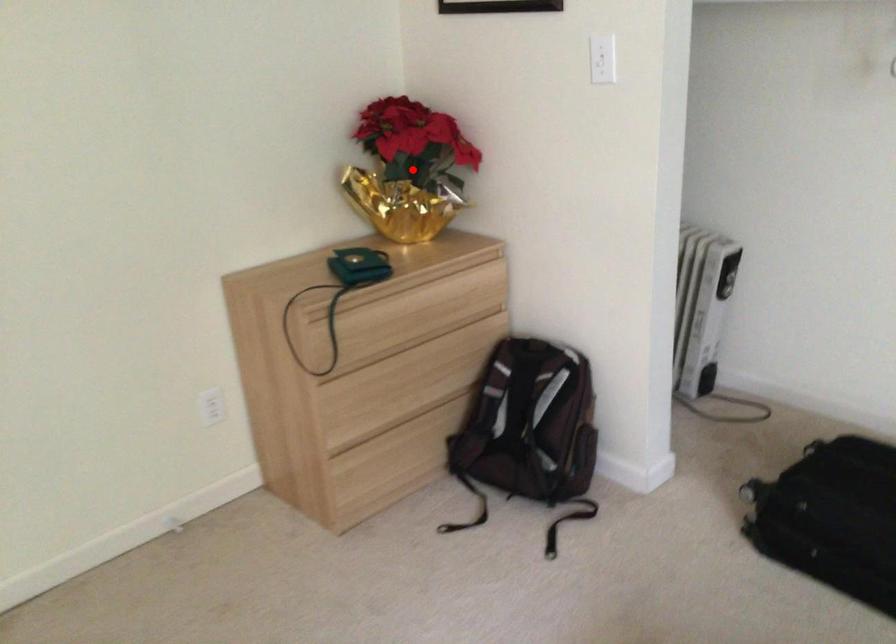
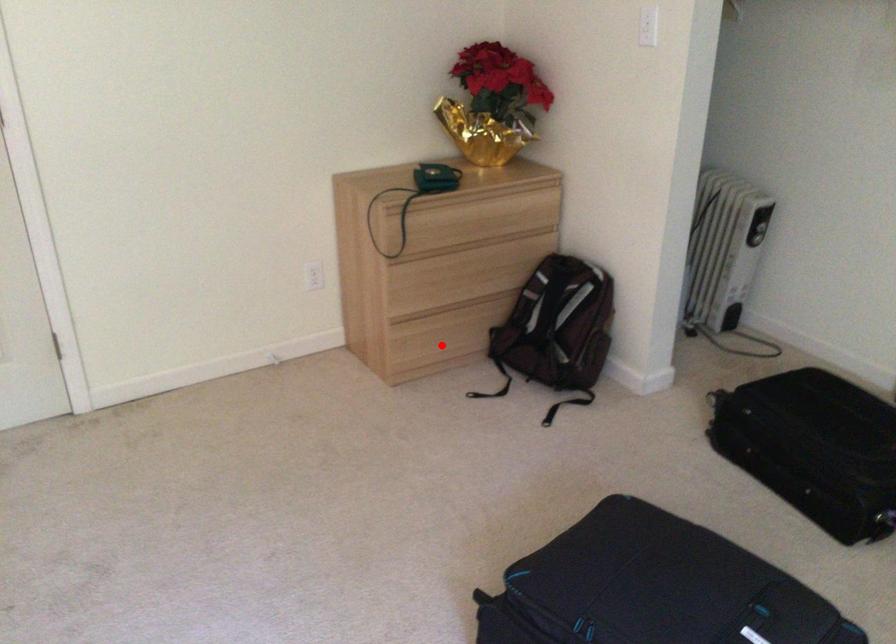
I am providing you with two images of the same scene from different viewpoints. A red point is marked on the first image and another point is marked on the second image. Does the point marked in image1 correspond to the same location as the one in image2?

No